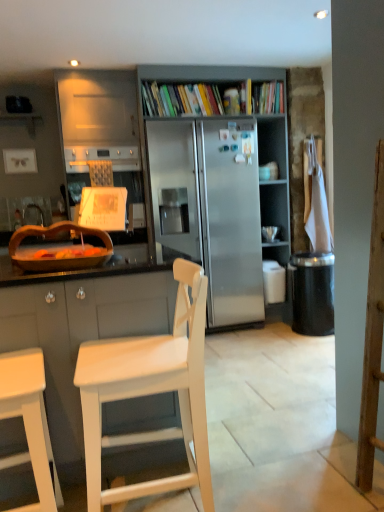
Question: Could you tell me if wooden bowl at left is facing matte blue coffee cup at upper right?

Choices:
 (A) yes
 (B) no

Answer: (B)

Question: Is wooden bowl at left closer to camera compared to matte blue coffee cup at upper right?

Choices:
 (A) no
 (B) yes

Answer: (B)

Question: Can matte blue coffee cup at upper right be found inside wooden bowl at left?

Choices:
 (A) no
 (B) yes

Answer: (A)

Question: Would you say wooden bowl at left is outside matte blue coffee cup at upper right?

Choices:
 (A) no
 (B) yes

Answer: (B)

Question: From a real-world perspective, is wooden bowl at left beneath matte blue coffee cup at upper right?

Choices:
 (A) yes
 (B) no

Answer: (A)

Question: Is wooden bowl at left facing away from matte blue coffee cup at upper right?

Choices:
 (A) yes
 (B) no

Answer: (B)

Question: Does white matte chair at lower left, positioned as the first chair in left-to-right order, have a greater height compared to brushed metal faucet at left?

Choices:
 (A) yes
 (B) no

Answer: (A)

Question: Does white matte chair at lower left, arranged as the 2th chair when viewed from the right, appear on the left side of brushed metal faucet at left?

Choices:
 (A) yes
 (B) no

Answer: (B)

Question: Does white matte chair at lower left, arranged as the 2th chair when viewed from the right, have a lesser height compared to brushed metal faucet at left?

Choices:
 (A) no
 (B) yes

Answer: (A)

Question: Could you tell me if white matte chair at lower left, positioned as the first chair in left-to-right order, is turned towards brushed metal faucet at left?

Choices:
 (A) yes
 (B) no

Answer: (B)

Question: Is white matte chair at lower left, arranged as the 2th chair when viewed from the right, further to camera compared to brushed metal faucet at left?

Choices:
 (A) yes
 (B) no

Answer: (B)

Question: Does white matte chair at lower left, positioned as the first chair in left-to-right order, contain brushed metal faucet at left?

Choices:
 (A) yes
 (B) no

Answer: (B)

Question: Is white wood chair at center, the 2th chair positioned from the left, taller than wooden bowl at left?

Choices:
 (A) yes
 (B) no

Answer: (A)